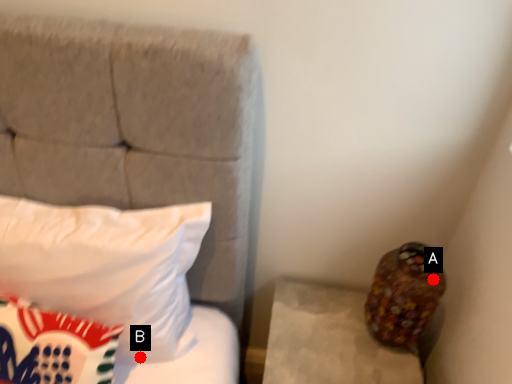
Question: Two points are circled on the image, labeled by A and B beside each circle. Which point is further to the camera?

Choices:
 (A) A is further
 (B) B is further

Answer: (B)